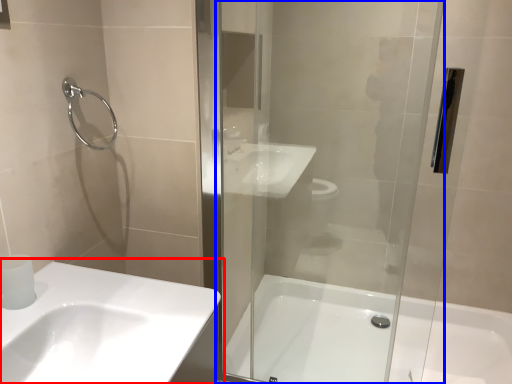
Question: Which point is closer to the camera, sink (highlighted by a red box) or screen door (highlighted by a blue box)?

Choices:
 (A) sink
 (B) screen door

Answer: (A)